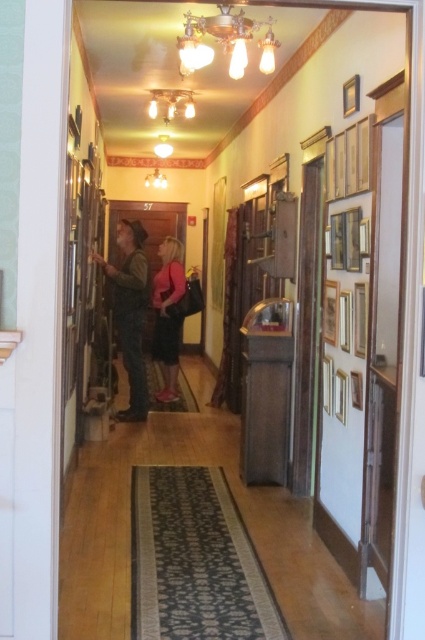
Question: Among these objects, which one is farthest from the camera?

Choices:
 (A) camouflage pants at center
 (B) matte pink dress at center

Answer: (B)

Question: Does camouflage pants at center lie in front of matte pink dress at center?

Choices:
 (A) no
 (B) yes

Answer: (B)

Question: Does camouflage pants at center have a larger size compared to matte pink dress at center?

Choices:
 (A) yes
 (B) no

Answer: (A)

Question: Is camouflage pants at center above matte pink dress at center?

Choices:
 (A) no
 (B) yes

Answer: (B)

Question: Which point is farther from the camera taking this photo?

Choices:
 (A) (159, 317)
 (B) (136, 381)

Answer: (A)